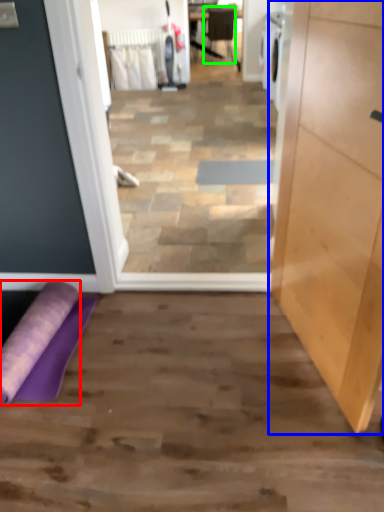
Question: Which object is the farthest from beach towel (highlighted by a red box)? Choose among these: cabinetry (highlighted by a blue box) or chair (highlighted by a green box).

Choices:
 (A) cabinetry
 (B) chair

Answer: (B)